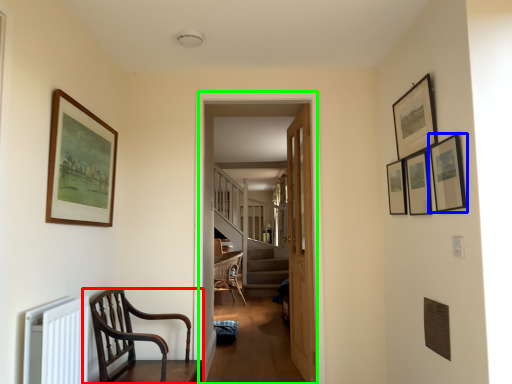
Question: Which object is positioned closest to chair (highlighted by a red box)? Select from picture frame (highlighted by a blue box) and corridor (highlighted by a green box).

Choices:
 (A) picture frame
 (B) corridor

Answer: (B)